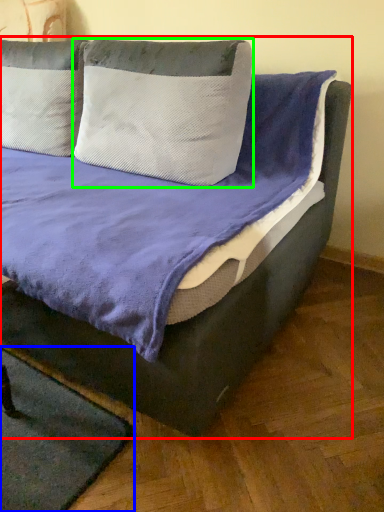
Question: Which object is positioned farthest from bed (highlighted by a red box)? Select from mat (highlighted by a blue box) and pillow (highlighted by a green box).

Choices:
 (A) mat
 (B) pillow

Answer: (A)